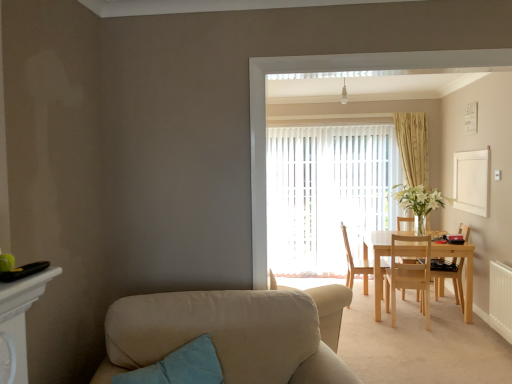
This screenshot has height=384, width=512. In order to click on free space in front of light wood chair at center, which is the second chair from left to right in this screenshot , I will do `click(428, 337)`.